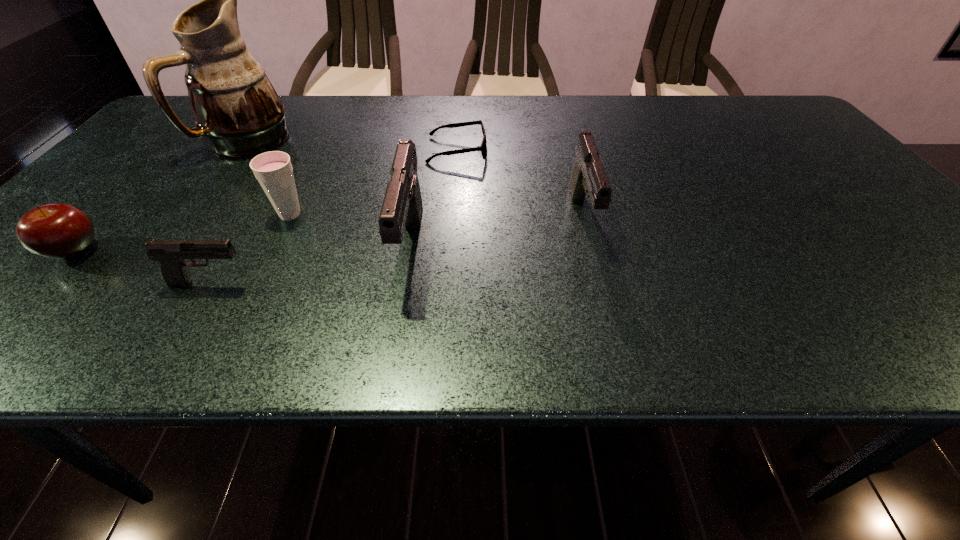
Locate which object is the third closest to the tallest object. Please provide its 2D coordinates. Your answer should be formatted as a tuple, i.e. [(x, y)], where the tuple contains the x and y coordinates of a point satisfying the conditions above.

[(483, 148)]

Locate an element on the screen. This screenshot has width=960, height=540. object that stands as the fifth closest to the shortest object is located at coordinates (171, 253).

I want to click on the closest pistol to the fifth shortest object, so click(x=402, y=207).

Identify the location of the second closest pistol to the second pistol from left to right. (588, 178).

The height and width of the screenshot is (540, 960). What are the coordinates of `blank area in the image that satisfies the following two spatial constraints: 1. aim along the barrel of the second pistol from left to right; 2. aim along the barrel of the leftmost pistol` in the screenshot? It's located at (405, 283).

Where is `vacant area in the image that satisfies the following two spatial constraints: 1. on the front-facing side of the sunglasses; 2. aim along the barrel of the second pistol from right to left`? The width and height of the screenshot is (960, 540). vacant area in the image that satisfies the following two spatial constraints: 1. on the front-facing side of the sunglasses; 2. aim along the barrel of the second pistol from right to left is located at coordinates (450, 248).

At what (x,y) coordinates should I click in order to perform the action: click on vacant region that satisfies the following two spatial constraints: 1. aim along the barrel of the second pistol from right to left; 2. aim along the barrel of the leftmost pistol. Please return your answer as a coordinate pair (x, y). The height and width of the screenshot is (540, 960). Looking at the image, I should click on (405, 283).